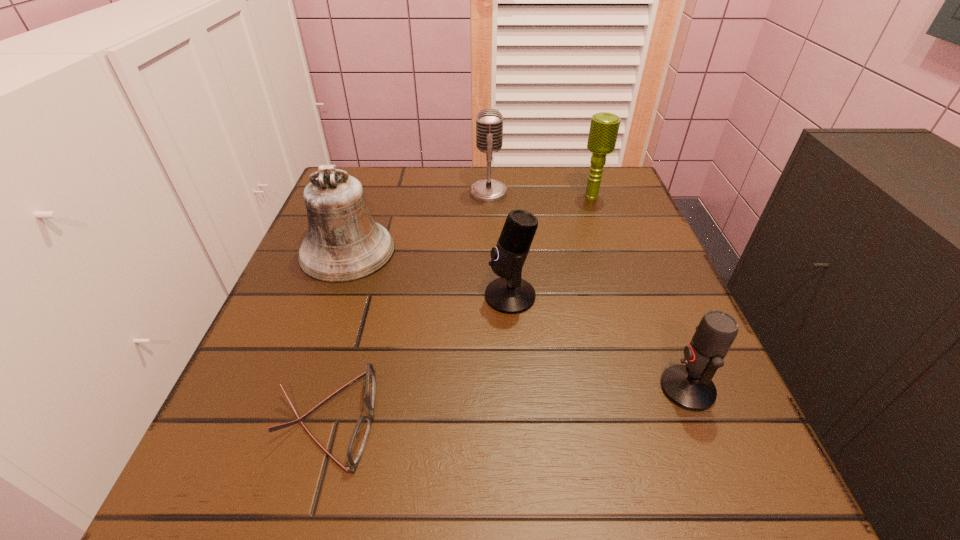
The height and width of the screenshot is (540, 960). In order to click on the third closest microphone to the third farthest microphone in this screenshot , I will do `click(604, 127)`.